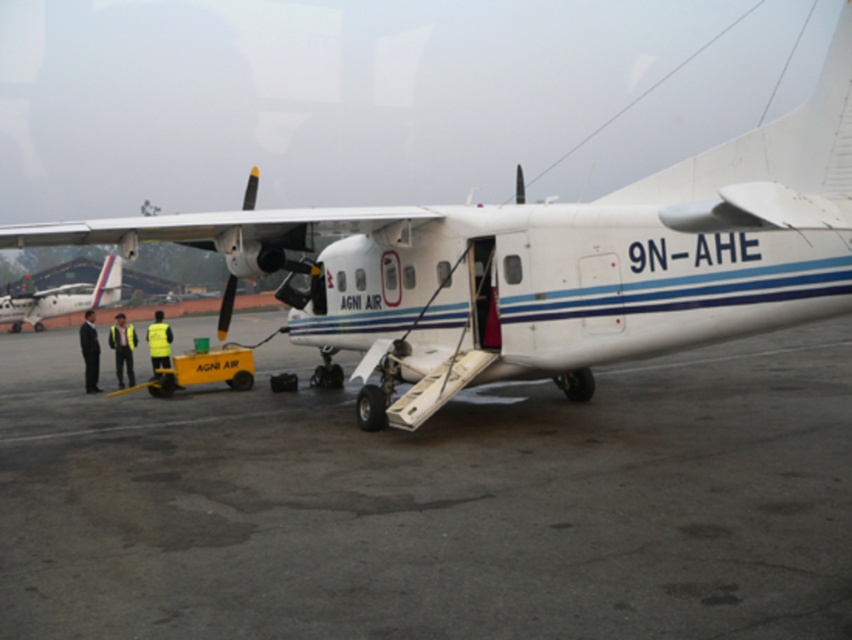
Question: Among these objects, which one is farthest from the camera?

Choices:
 (A) white matte airplane at center
 (B) yellow reflective vest at left
 (C) yellow reflective vest at center
 (D) gray asphalt tarmac at center

Answer: (B)

Question: Which object appears closest to the camera in this image?

Choices:
 (A) yellow reflective vest at left
 (B) black suit at left

Answer: (A)

Question: Does gray asphalt tarmac at center have a greater width compared to white glossy airplane at left?

Choices:
 (A) no
 (B) yes

Answer: (B)

Question: Is white glossy airplane at left thinner than black suit at left?

Choices:
 (A) no
 (B) yes

Answer: (B)

Question: Among these points, which one is farthest from the camera?

Choices:
 (A) (124, 333)
 (B) (839, 32)
 (C) (72, 291)
 (D) (487, 422)

Answer: (C)

Question: Observing the image, what is the correct spatial positioning of white matte airplane at center in reference to black suit at left?

Choices:
 (A) right
 (B) left

Answer: (A)